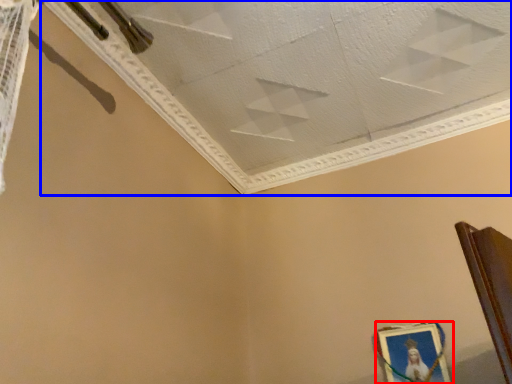
Question: Which of the following is the farthest to the observer, picture frame (highlighted by a red box) or wide (highlighted by a blue box)?

Choices:
 (A) picture frame
 (B) wide

Answer: (A)